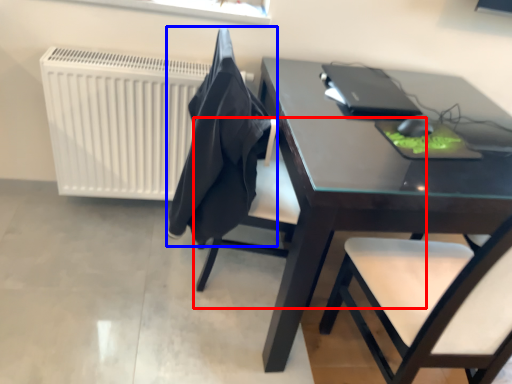
Question: Which object appears farthest to the camera in this image, chair (highlighted by a red box) or cloth (highlighted by a blue box)?

Choices:
 (A) chair
 (B) cloth

Answer: (A)